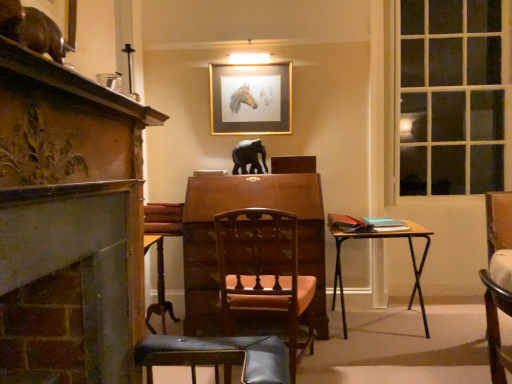
Locate an element on the screen. empty space that is to the right of wooden chair with carved backrest at center, the 2th chair from the right is located at coordinates (351, 365).